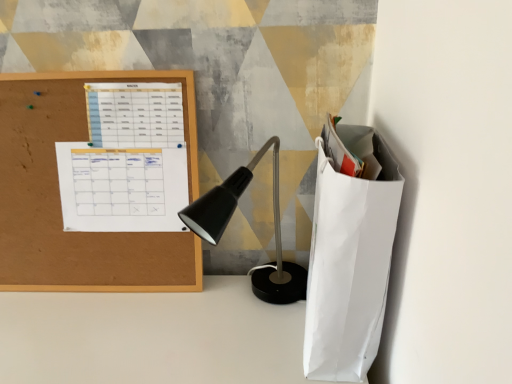
Question: From a real-world perspective, is cork board at left positioned under white paper calendar at upper left, the second notebook viewed from the top, based on gravity?

Choices:
 (A) no
 (B) yes

Answer: (A)

Question: Considering the relative sizes of cork board at left and white paper calendar at upper left, which appears as the 1th notebook when ordered from the bottom, in the image provided, is cork board at left smaller than white paper calendar at upper left, which appears as the 1th notebook when ordered from the bottom,?

Choices:
 (A) no
 (B) yes

Answer: (A)

Question: Considering the relative positions of cork board at left and white paper calendar at upper left, which appears as the 1th notebook when ordered from the bottom, in the image provided, is cork board at left behind white paper calendar at upper left, which appears as the 1th notebook when ordered from the bottom,?

Choices:
 (A) no
 (B) yes

Answer: (A)

Question: Is cork board at left facing towards white paper calendar at upper left, the second notebook viewed from the top?

Choices:
 (A) yes
 (B) no

Answer: (A)

Question: Could white paper calendar at upper left, the second notebook viewed from the top, be considered to be inside cork board at left?

Choices:
 (A) no
 (B) yes

Answer: (B)

Question: Would you say cork board at left is outside white paper calendar at upper left, which appears as the 1th notebook when ordered from the bottom?

Choices:
 (A) no
 (B) yes

Answer: (B)

Question: Is white paper bag at right positioned beyond the bounds of white paper calendar at upper left, marked as the 1th notebook in a top-to-bottom arrangement?

Choices:
 (A) no
 (B) yes

Answer: (B)

Question: Is white paper bag at right with white paper calendar at upper left, arranged as the 2th notebook when ordered from the bottom?

Choices:
 (A) yes
 (B) no

Answer: (B)

Question: From the image's perspective, is white paper bag at right below white paper calendar at upper left, marked as the 1th notebook in a top-to-bottom arrangement?

Choices:
 (A) no
 (B) yes

Answer: (B)

Question: Is white paper bag at right positioned behind white paper calendar at upper left, marked as the 1th notebook in a top-to-bottom arrangement?

Choices:
 (A) no
 (B) yes

Answer: (A)

Question: From a real-world perspective, does white paper bag at right sit lower than white paper calendar at upper left, marked as the 1th notebook in a top-to-bottom arrangement?

Choices:
 (A) yes
 (B) no

Answer: (A)

Question: Is white paper bag at right facing towards white paper calendar at upper left, marked as the 1th notebook in a top-to-bottom arrangement?

Choices:
 (A) no
 (B) yes

Answer: (B)

Question: Considering the relative sizes of white paper bag at right and cork board at left in the image provided, is white paper bag at right thinner than cork board at left?

Choices:
 (A) yes
 (B) no

Answer: (B)